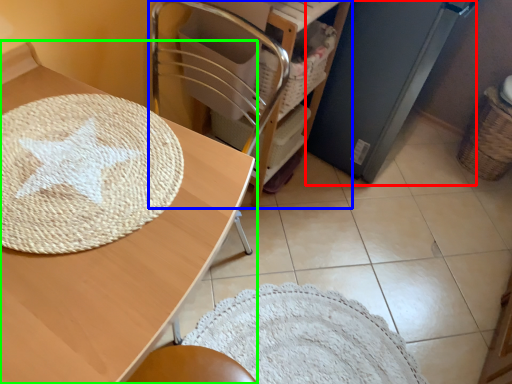
Question: Which is nearer to the appliance (highlighted by a red box)? furniture (highlighted by a blue box) or table (highlighted by a green box).

Choices:
 (A) furniture
 (B) table

Answer: (A)